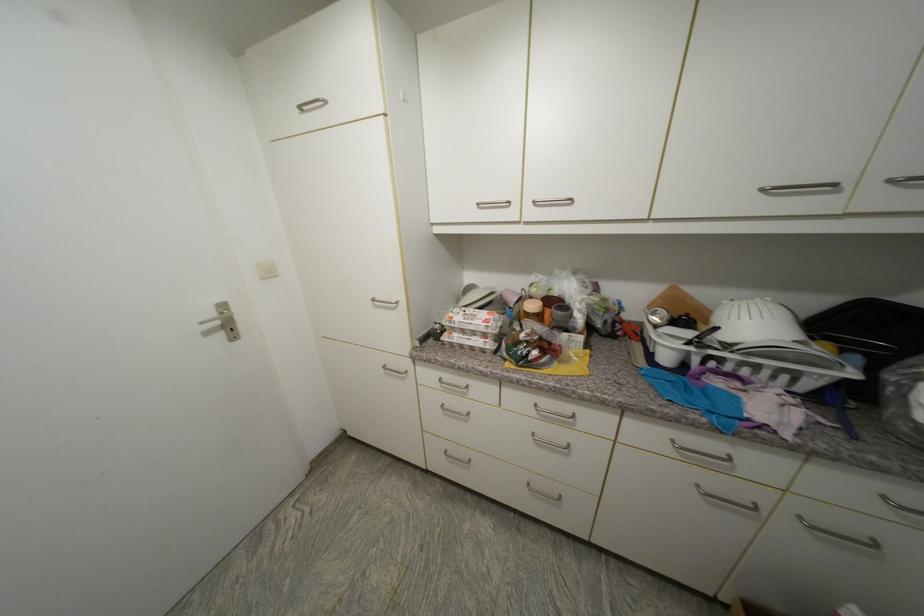
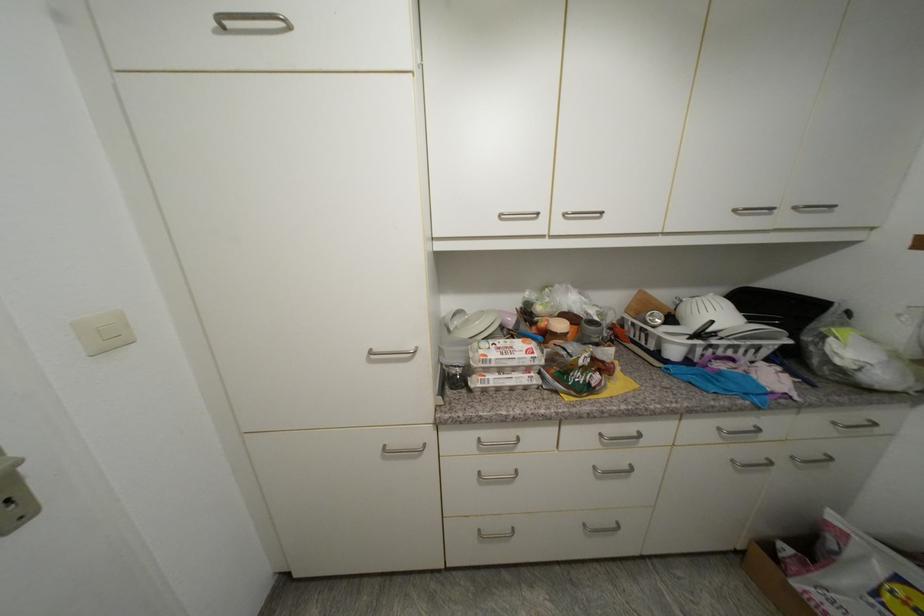
Locate, in the second image, the point that corresponds to (768,191) in the first image.

(740, 213)